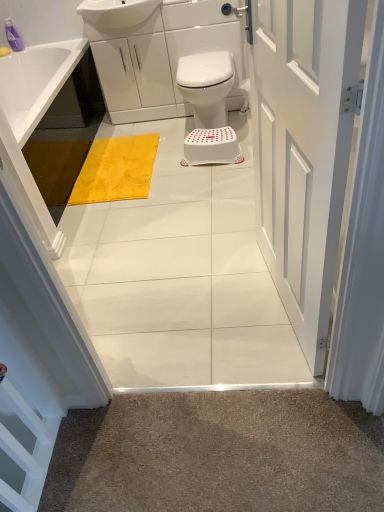
At what (x,y) coordinates should I click in order to perform the action: click on empty space that is ontop of white plastic stool at center (from a real-world perspective). Please return your answer as a coordinate pair (x, y). Image resolution: width=384 pixels, height=512 pixels. Looking at the image, I should click on (219, 136).